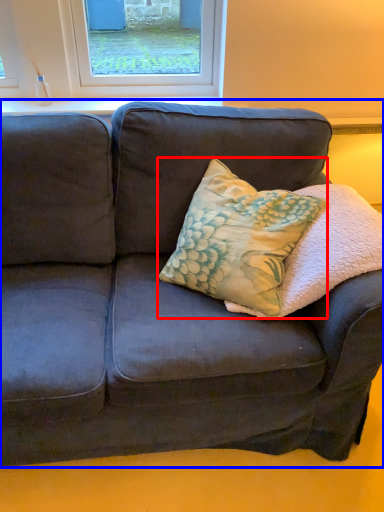
Question: Which object appears closest to the camera in this image, throw pillow (highlighted by a red box) or studio couch (highlighted by a blue box)?

Choices:
 (A) throw pillow
 (B) studio couch

Answer: (A)